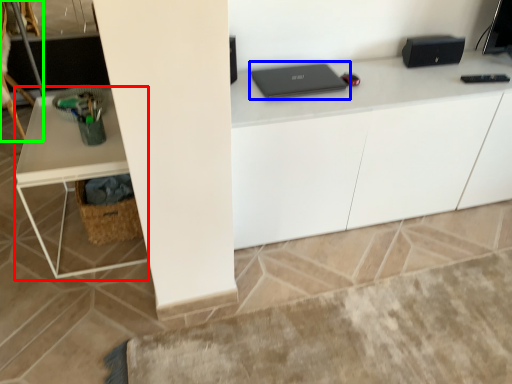
Question: Considering the real-world distances, which object is farthest from computer desk (highlighted by a red box)? laptop (highlighted by a blue box) or swivel chair (highlighted by a green box)?

Choices:
 (A) laptop
 (B) swivel chair

Answer: (B)